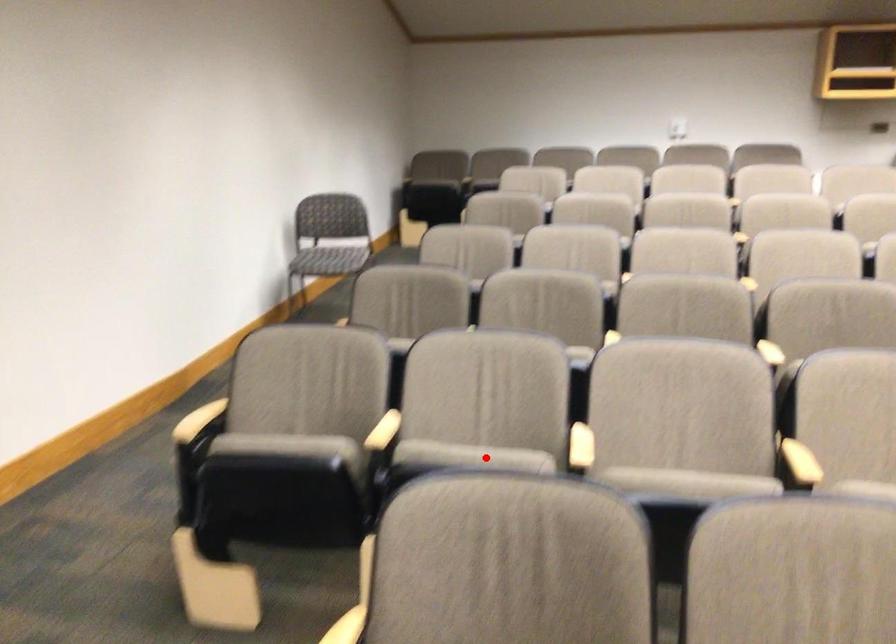
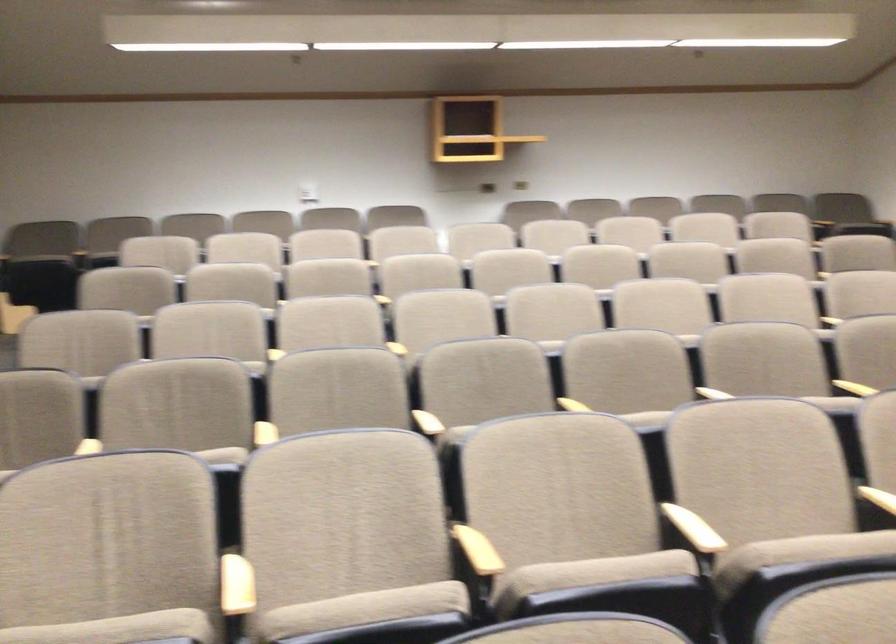
Question: I am providing you with two images of the same scene from different viewpoints. A red point is marked on the first image. Is the red point's position out of view in image 2?

Choices:
 (A) Yes
 (B) No

Answer: (B)